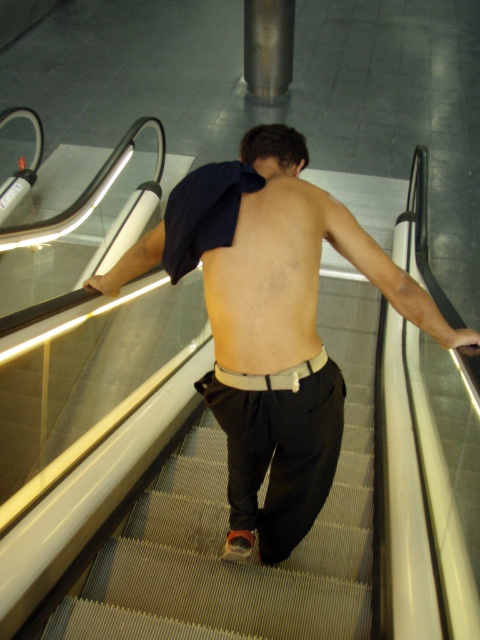
Question: In this image, where is skinny beige skin at back located relative to black cotton pants at center?

Choices:
 (A) right
 (B) left

Answer: (A)

Question: Is matte black pants at center above smooth gray stairs at center?

Choices:
 (A) yes
 (B) no

Answer: (A)

Question: Among these points, which one is farthest from the camera?

Choices:
 (A) (240, 428)
 (B) (288, 186)
 (C) (226, 609)
 (D) (254, 268)

Answer: (C)

Question: Can you confirm if skinny beige skin at back is positioned below black cotton pants at center?

Choices:
 (A) no
 (B) yes

Answer: (A)

Question: Which point is closer to the camera taking this photo?

Choices:
 (A) (360, 550)
 (B) (256, 451)

Answer: (B)

Question: Which point is closer to the camera?

Choices:
 (A) (241, 154)
 (B) (312, 308)
 (C) (340, 552)
 (D) (275, 433)

Answer: (B)